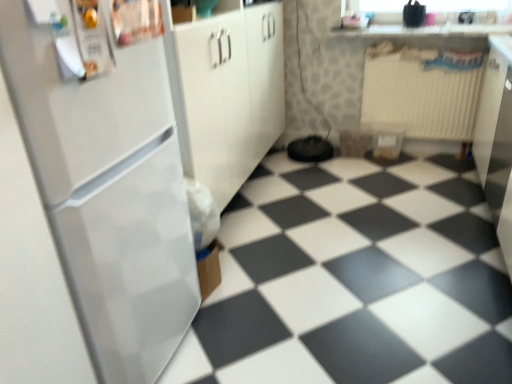
Question: Can you confirm if white glossy tile at lower left is bigger than white plastic radiator at upper right?

Choices:
 (A) no
 (B) yes

Answer: (B)

Question: From the image's perspective, is white glossy tile at lower left on top of white plastic radiator at upper right?

Choices:
 (A) yes
 (B) no

Answer: (B)

Question: Is white glossy tile at lower left further to camera compared to white plastic radiator at upper right?

Choices:
 (A) yes
 (B) no

Answer: (B)

Question: Is white glossy tile at lower left beside white plastic radiator at upper right?

Choices:
 (A) yes
 (B) no

Answer: (B)

Question: Can you confirm if white glossy tile at lower left is wider than white plastic radiator at upper right?

Choices:
 (A) no
 (B) yes

Answer: (B)

Question: Does white glossy tile at lower left have a lesser height compared to white plastic radiator at upper right?

Choices:
 (A) yes
 (B) no

Answer: (A)

Question: Does white glossy countertop at upper center have a greater width compared to white glossy refrigerator at left?

Choices:
 (A) no
 (B) yes

Answer: (A)

Question: From a real-world perspective, is white glossy countertop at upper center below white glossy refrigerator at left?

Choices:
 (A) no
 (B) yes

Answer: (A)

Question: Considering the relative positions of white glossy countertop at upper center and white glossy refrigerator at left in the image provided, is white glossy countertop at upper center to the right of white glossy refrigerator at left from the viewer's perspective?

Choices:
 (A) no
 (B) yes

Answer: (B)

Question: Considering the relative sizes of white glossy countertop at upper center and white glossy refrigerator at left in the image provided, is white glossy countertop at upper center thinner than white glossy refrigerator at left?

Choices:
 (A) yes
 (B) no

Answer: (A)

Question: From the image's perspective, would you say white glossy countertop at upper center is shown under white glossy refrigerator at left?

Choices:
 (A) yes
 (B) no

Answer: (B)

Question: Is white glossy countertop at upper center directly adjacent to white glossy refrigerator at left?

Choices:
 (A) no
 (B) yes

Answer: (A)

Question: Is white plastic radiator at upper right turned away from white glossy tile at lower left?

Choices:
 (A) yes
 (B) no

Answer: (B)